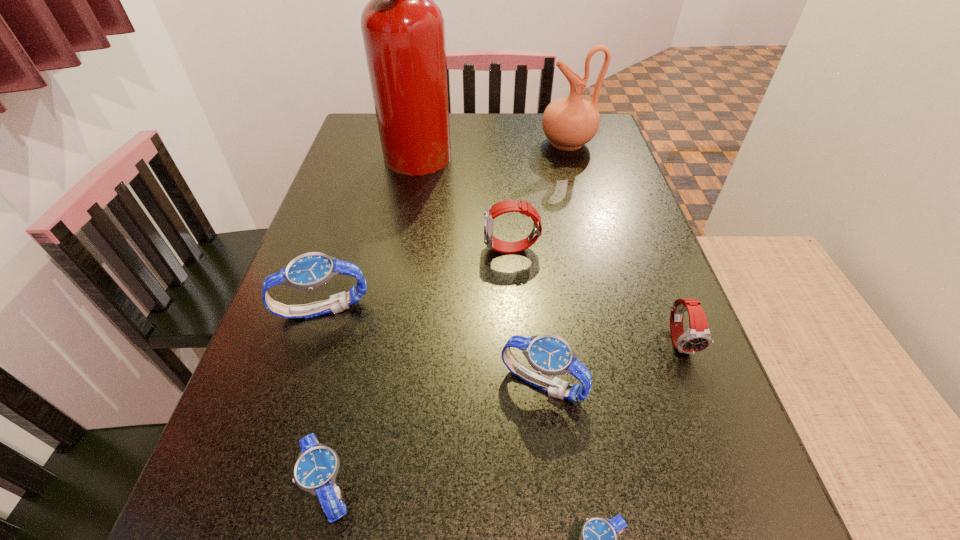
Identify the location of free location located 0.210m on the face of the rightmost watch. (737, 487).

The height and width of the screenshot is (540, 960). What are the coordinates of `vacant space located 0.360m on the back of the second shortest watch` in the screenshot? It's located at coord(376,276).

This screenshot has width=960, height=540. Identify the location of fire extinguisher at the far edge. point(403,30).

Find the location of `pottery located at the far edge`. pottery located at the far edge is located at coordinates (569, 123).

This screenshot has height=540, width=960. I want to click on fire extinguisher located in the left edge section of the desktop, so click(x=403, y=30).

Identify the location of pottery at the right edge. (569, 123).

Identify the location of watch that is at the right edge. The height and width of the screenshot is (540, 960). (697, 338).

Locate an element on the screen. The image size is (960, 540). object that is at the far left corner is located at coordinates (403, 30).

Locate an element on the screen. The image size is (960, 540). object at the far right corner is located at coordinates (569, 123).

Find the location of a particular element. The image size is (960, 540). free location at the far edge of the desktop is located at coordinates (487, 115).